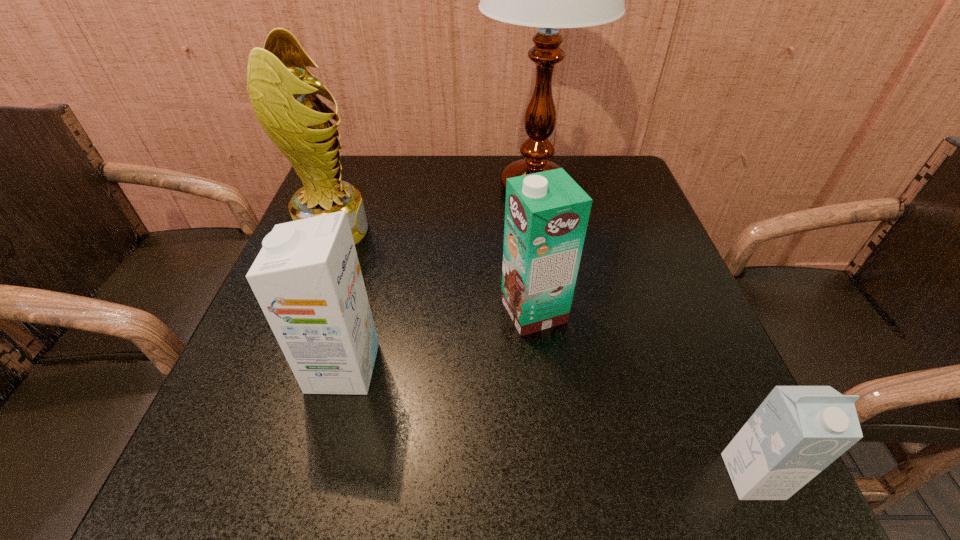
Where is `vacant space positioned 0.190m on the right of the farthest carton`? This screenshot has width=960, height=540. vacant space positioned 0.190m on the right of the farthest carton is located at coordinates (666, 311).

At what (x,y) coordinates should I click in order to perform the action: click on vacant region located 0.120m on the left of the fourth farthest object. Please return your answer as a coordinate pair (x, y). The width and height of the screenshot is (960, 540). Looking at the image, I should click on (240, 368).

I want to click on object that is positioned at the far edge, so click(x=548, y=0).

This screenshot has width=960, height=540. I want to click on object positioned at the near edge, so click(x=797, y=431).

Locate an element on the screen. The width and height of the screenshot is (960, 540). award that is at the left edge is located at coordinates (283, 93).

Locate an element on the screen. carton that is at the left edge is located at coordinates point(307,279).

Identify the location of table lamp present at the right edge. (548, 0).

Find the location of `carton at the right edge`. carton at the right edge is located at coordinates (797, 431).

Find the location of a particular element. The width and height of the screenshot is (960, 540). object located in the far right corner section of the desktop is located at coordinates (548, 0).

Image resolution: width=960 pixels, height=540 pixels. What are the coordinates of `object at the near right corner` in the screenshot? It's located at (797, 431).